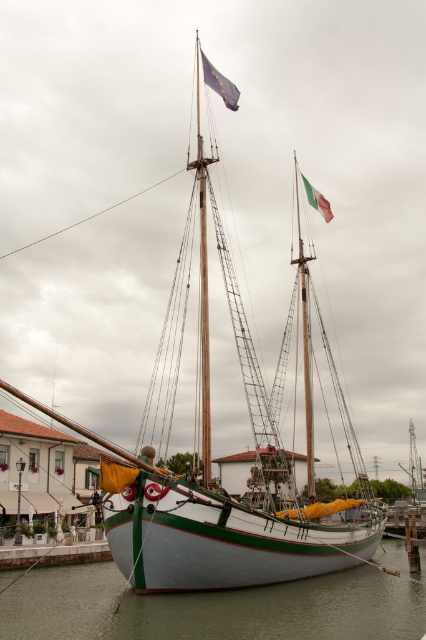
Is blue fabric flag at upper center shorter than green fabric flag at upper right?

Yes.

Looking at this image, does blue fabric flag at upper center appear on the left side of green fabric flag at upper right?

Correct, you'll find blue fabric flag at upper center to the left of green fabric flag at upper right.

This screenshot has height=640, width=426. What do you see at coordinates (219, 83) in the screenshot? I see `blue fabric flag at upper center` at bounding box center [219, 83].

The height and width of the screenshot is (640, 426). In order to click on blue fabric flag at upper center in this screenshot , I will do click(x=219, y=83).

Does green matte water at lower center have a lesser height compared to blue fabric flag at upper center?

Incorrect, green matte water at lower center's height does not fall short of blue fabric flag at upper center's.

Consider the image. How distant is green matte water at lower center from blue fabric flag at upper center?

They are 67.17 meters apart.

Between point (40, 600) and point (221, 90), which one is positioned in front?

Point (40, 600) is in front.

Locate an element on the screen. The height and width of the screenshot is (640, 426). green matte water at lower center is located at coordinates (218, 605).

Is yellow fabric at center wider than blue fabric flag at upper center?

No, yellow fabric at center is not wider than blue fabric flag at upper center.

Does yellow fabric at center have a lesser height compared to blue fabric flag at upper center?

Indeed, yellow fabric at center has a lesser height compared to blue fabric flag at upper center.

Does point (103, 461) come in front of point (238, 93)?

Yes, it is in front of point (238, 93).

At what (x,y) coordinates should I click in order to perform the action: click on yellow fabric at center. Please return your answer as a coordinate pair (x, y). This screenshot has width=426, height=640. Looking at the image, I should click on (115, 476).